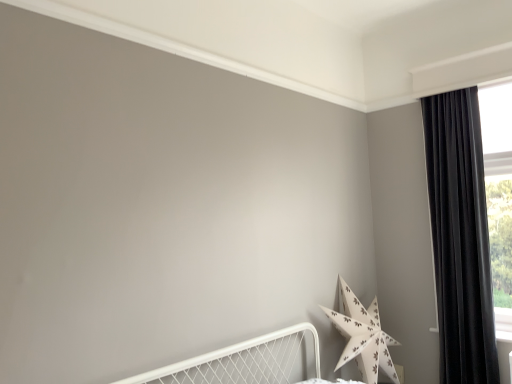
Question: Is black velvet curtain at right taller or shorter than white paper star at lower right?

Choices:
 (A) tall
 (B) short

Answer: (A)

Question: Based on their sizes in the image, would you say black velvet curtain at right is bigger or smaller than white paper star at lower right?

Choices:
 (A) small
 (B) big

Answer: (A)

Question: Considering the positions of point 489,286 and point 347,321, is point 489,286 closer or farther from the camera than point 347,321?

Choices:
 (A) farther
 (B) closer

Answer: (B)

Question: In terms of height, does white paper star at lower right look taller or shorter compared to black velvet curtain at right?

Choices:
 (A) tall
 (B) short

Answer: (B)

Question: From a real-world perspective, is white paper star at lower right positioned above or below black velvet curtain at right?

Choices:
 (A) above
 (B) below

Answer: (B)

Question: From the image's perspective, is white paper star at lower right above or below black velvet curtain at right?

Choices:
 (A) above
 (B) below

Answer: (B)

Question: Visually, is white paper star at lower right positioned to the left or to the right of black velvet curtain at right?

Choices:
 (A) right
 (B) left

Answer: (B)